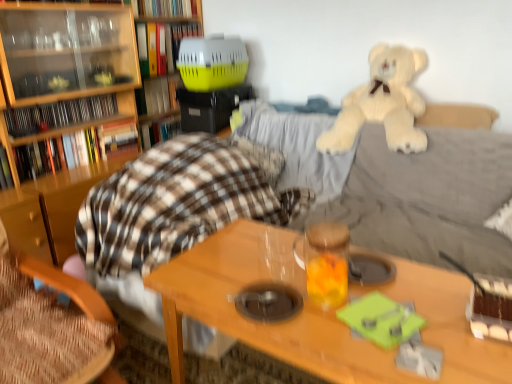
Question: Is hardcover book at upper center, the first book when ordered from top to bottom, surrounded by wooden chair at lower left?

Choices:
 (A) yes
 (B) no

Answer: (B)

Question: Is wooden chair at lower left not near hardcover book at upper center, which is counted as the 7th book, starting from the bottom?

Choices:
 (A) no
 (B) yes

Answer: (B)

Question: Does wooden chair at lower left have a lesser width compared to hardcover book at upper center, the first book when ordered from top to bottom?

Choices:
 (A) no
 (B) yes

Answer: (A)

Question: Is wooden chair at lower left shorter than hardcover book at upper center, the first book when ordered from top to bottom?

Choices:
 (A) no
 (B) yes

Answer: (A)

Question: Can you confirm if wooden chair at lower left is wider than hardcover book at upper center, the first book when ordered from top to bottom?

Choices:
 (A) no
 (B) yes

Answer: (B)

Question: Does wooden chair at lower left lie in front of hardcover book at upper center, which is counted as the 7th book, starting from the bottom?

Choices:
 (A) yes
 (B) no

Answer: (A)

Question: Is yellow plastic pet carrier at upper center, arranged as the second book when viewed from the top, not inside wooden table at center?

Choices:
 (A) no
 (B) yes

Answer: (B)

Question: From a real-world perspective, does yellow plastic pet carrier at upper center, arranged as the second book when viewed from the top, stand above wooden table at center?

Choices:
 (A) yes
 (B) no

Answer: (A)

Question: Is yellow plastic pet carrier at upper center, the 6th book in the bottom-to-top sequence, at the left side of wooden table at center?

Choices:
 (A) no
 (B) yes

Answer: (B)

Question: Is yellow plastic pet carrier at upper center, arranged as the second book when viewed from the top, positioned in front of wooden table at center?

Choices:
 (A) no
 (B) yes

Answer: (A)

Question: Considering the relative sizes of yellow plastic pet carrier at upper center, the 6th book in the bottom-to-top sequence, and wooden table at center in the image provided, is yellow plastic pet carrier at upper center, the 6th book in the bottom-to-top sequence, taller than wooden table at center?

Choices:
 (A) yes
 (B) no

Answer: (B)

Question: Can you confirm if yellow plastic pet carrier at upper center, the 6th book in the bottom-to-top sequence, is wider than wooden table at center?

Choices:
 (A) no
 (B) yes

Answer: (A)

Question: Is plaid fabric blanket at center, the third book positioned from the bottom, smaller than translucent glass jar at center?

Choices:
 (A) yes
 (B) no

Answer: (B)